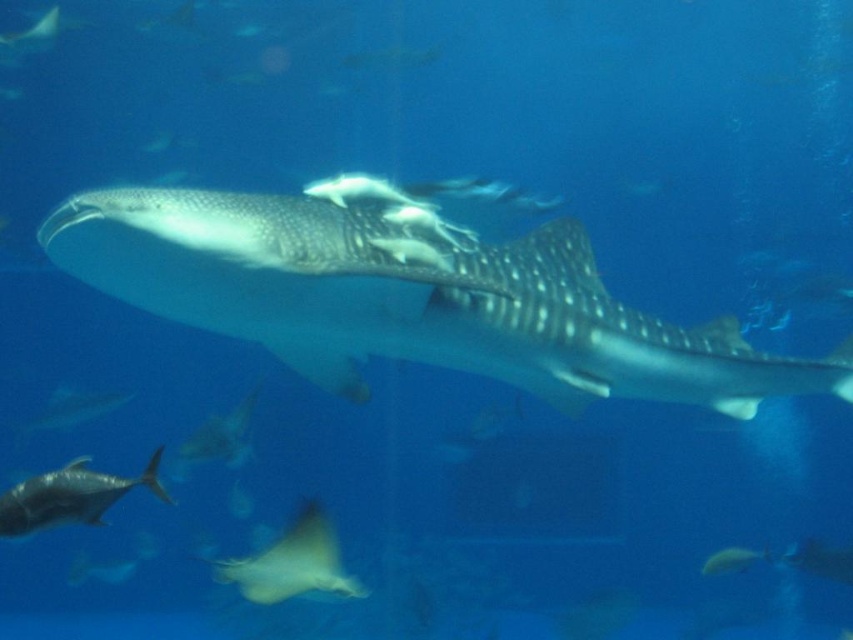
Is point (248, 588) behind point (15, 506)?

Yes, it is behind point (15, 506).

Does translucent yellow ray at lower center have a larger size compared to shiny silver fish at lower left?

Yes, translucent yellow ray at lower center is bigger than shiny silver fish at lower left.

Between point (239, 580) and point (149, 480), which one is positioned behind?

The point (239, 580) is more distant.

Locate an element on the screen. This screenshot has height=640, width=853. translucent yellow ray at lower center is located at coordinates (293, 563).

Does shiny silver fish at lower left lie behind shiny silver fish at center?

No, it is in front of shiny silver fish at center.

Is point (36, 490) more distant than point (717, 552)?

No, it is not.

Identify the location of shiny silver fish at lower left. (68, 497).

Which is more to the left, translucent yellow ray at lower center or shiny silver fish at center?

Positioned to the left is translucent yellow ray at lower center.

Measure the distance between translucent yellow ray at lower center and camera.

translucent yellow ray at lower center and camera are 10.12 feet apart from each other.

At what (x,y) coordinates should I click in order to perform the action: click on translucent yellow ray at lower center. Please return your answer as a coordinate pair (x, y). Looking at the image, I should click on (293, 563).